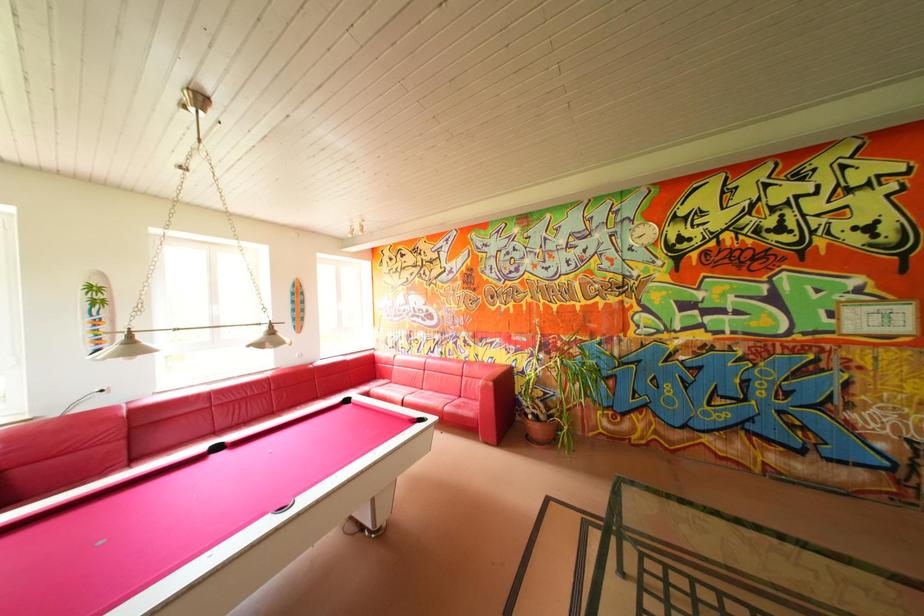
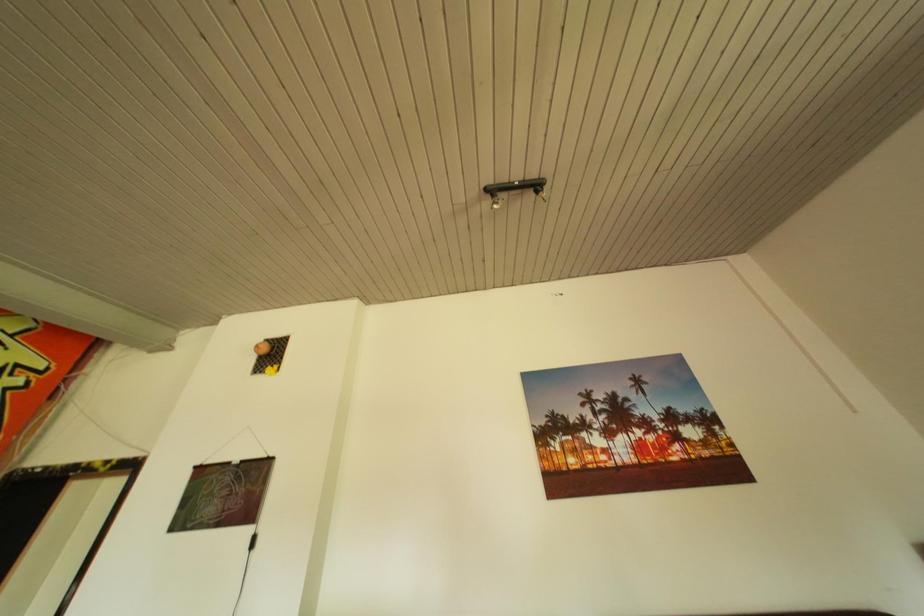
The images are taken continuously from a first-person perspective. In which direction is your viewpoint rotating?

The camera rotated toward right-up.